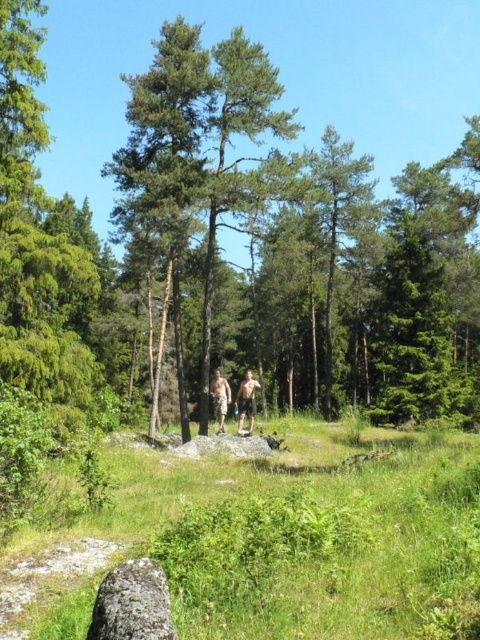
Question: Is green grassy at center above camouflage shorts at center?

Choices:
 (A) no
 (B) yes

Answer: (B)

Question: Estimate the real-world distances between objects in this image. Which object is farther from the green grassy at center?

Choices:
 (A) camouflage shorts at center
 (B) skinny man at center
 (C) gray rough rock at lower left

Answer: (B)

Question: Is green grassy at center above gray rough rock at lower left?

Choices:
 (A) no
 (B) yes

Answer: (A)

Question: Does green grassy at center have a lesser width compared to skinny man at center?

Choices:
 (A) yes
 (B) no

Answer: (B)

Question: Which point appears farthest from the camera in this image?

Choices:
 (A) (217, 420)
 (B) (163, 593)

Answer: (A)

Question: Which object appears closest to the camera in this image?

Choices:
 (A) camouflage shorts at center
 (B) green grassy at center
 (C) skinny man at center

Answer: (B)